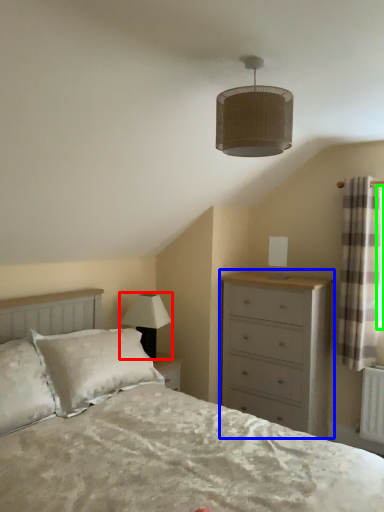
Question: Which object is the farthest from lamp (highlighted by a red box)? Choose among these: chest of drawers (highlighted by a blue box) or window screen (highlighted by a green box).

Choices:
 (A) chest of drawers
 (B) window screen

Answer: (B)